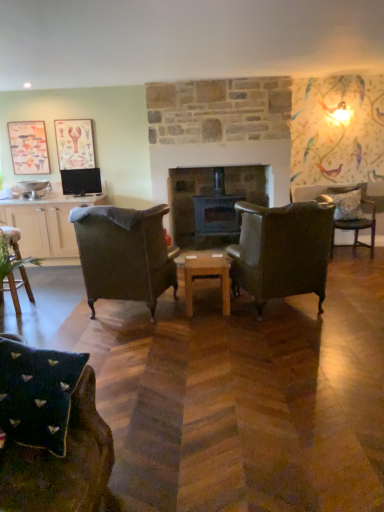
Question: Is matte paper picture frame at upper left, the 1th picture frame when ordered from right to left, smaller than dark gray stone fireplace at center?

Choices:
 (A) no
 (B) yes

Answer: (B)

Question: Considering the relative positions of matte paper picture frame at upper left, the 1th picture frame when ordered from right to left, and dark gray stone fireplace at center in the image provided, is matte paper picture frame at upper left, the 1th picture frame when ordered from right to left, in front of dark gray stone fireplace at center?

Choices:
 (A) yes
 (B) no

Answer: (B)

Question: From a real-world perspective, is matte paper picture frame at upper left, the second picture frame positioned from the left, positioned over dark gray stone fireplace at center based on gravity?

Choices:
 (A) yes
 (B) no

Answer: (A)

Question: From a real-world perspective, is matte paper picture frame at upper left, the second picture frame positioned from the left, physically below dark gray stone fireplace at center?

Choices:
 (A) yes
 (B) no

Answer: (B)

Question: Does matte paper picture frame at upper left, the 1th picture frame when ordered from right to left, have a greater width compared to dark gray stone fireplace at center?

Choices:
 (A) no
 (B) yes

Answer: (A)

Question: In terms of height, does matte paper picture frame at upper left, the 1th picture frame when ordered from right to left, look taller or shorter compared to wooden at center?

Choices:
 (A) short
 (B) tall

Answer: (B)

Question: From the image's perspective, relative to wooden at center, is matte paper picture frame at upper left, the 1th picture frame when ordered from right to left, above or below?

Choices:
 (A) below
 (B) above

Answer: (B)

Question: Would you say matte paper picture frame at upper left, the 1th picture frame when ordered from right to left, is to the left or to the right of wooden at center in the picture?

Choices:
 (A) right
 (B) left

Answer: (B)

Question: Is matte paper picture frame at upper left, the 1th picture frame when ordered from right to left, wider or thinner than wooden at center?

Choices:
 (A) wide
 (B) thin

Answer: (B)

Question: Is matte black tv at left wider or thinner than matte paper picture frame at upper left, the 1th picture frame when ordered from right to left?

Choices:
 (A) wide
 (B) thin

Answer: (A)

Question: Considering their positions, is matte black tv at left located in front of or behind matte paper picture frame at upper left, the second picture frame positioned from the left?

Choices:
 (A) behind
 (B) front

Answer: (B)

Question: Visually, is matte black tv at left positioned to the left or to the right of matte paper picture frame at upper left, the second picture frame positioned from the left?

Choices:
 (A) left
 (B) right

Answer: (B)

Question: Looking at the image, does matte black tv at left seem bigger or smaller compared to matte paper picture frame at upper left, the second picture frame positioned from the left?

Choices:
 (A) small
 (B) big

Answer: (B)

Question: In terms of width, does leather armchair at center, acting as the fourth chair starting from the left, look wider or thinner when compared to white textured pillow at right?

Choices:
 (A) thin
 (B) wide

Answer: (B)

Question: Does point pyautogui.click(x=296, y=281) appear closer or farther from the camera than point pyautogui.click(x=349, y=214)?

Choices:
 (A) closer
 (B) farther

Answer: (A)